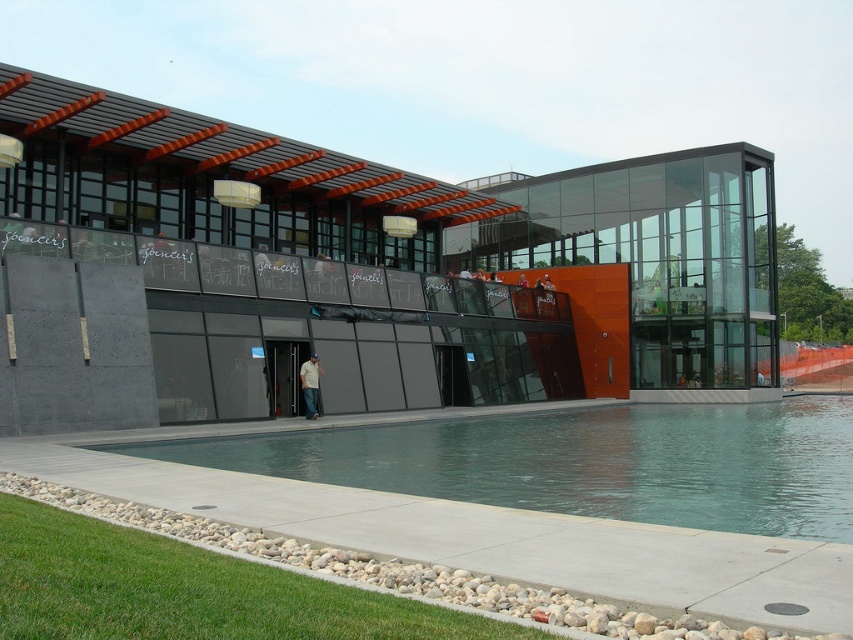
Based on the photo, you are standing at the edge of the green concrete pool at lower center and want to place a small potted plant on the denim jeans at center. Can the plant be placed there without falling into the pool?

The green concrete pool at lower center has a lesser height compared to denim jeans at center, so the denim jeans at center is higher. Therefore, placing the plant on the denim jeans at center would keep it from falling into the pool.